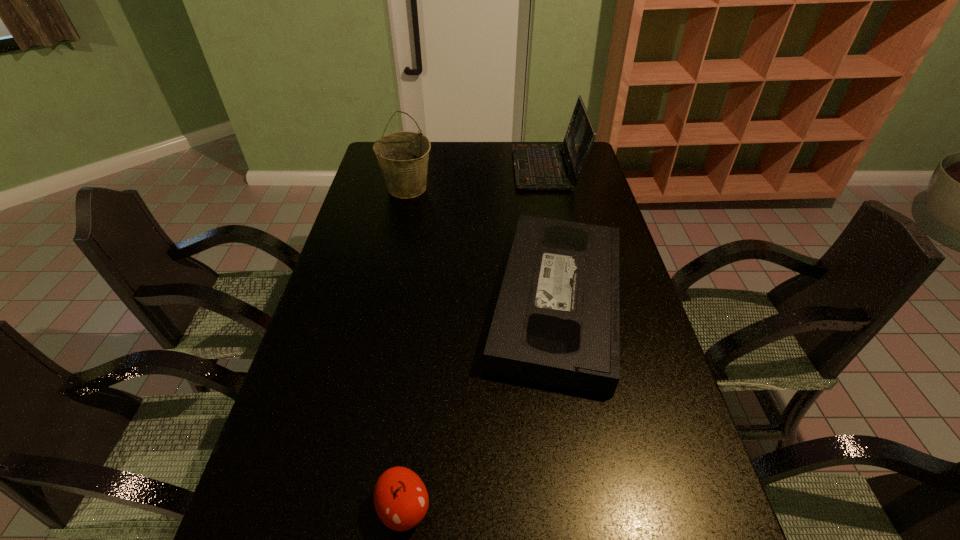
Identify the location of blank area located 0.230m on the right of the third tallest object. (550, 509).

The width and height of the screenshot is (960, 540). Find the location of `vacant space situated 0.060m on the front of the videotape`. vacant space situated 0.060m on the front of the videotape is located at coordinates [578, 421].

Find the location of a particular element. object present at the far edge is located at coordinates (537, 167).

Find the location of a particular element. object at the left edge is located at coordinates (403, 157).

Where is `laptop computer situated at the right edge`? The image size is (960, 540). laptop computer situated at the right edge is located at coordinates (537, 167).

I want to click on videotape at the right edge, so pos(556,322).

Identify the location of object present at the far right corner. This screenshot has height=540, width=960. (537, 167).

The height and width of the screenshot is (540, 960). Identify the location of vacant space at the far edge of the desktop. (484, 168).

The width and height of the screenshot is (960, 540). In the image, there is a desktop. What are the coordinates of `vacant space at the left edge` in the screenshot? It's located at (358, 251).

Locate an element on the screen. The height and width of the screenshot is (540, 960). free space at the right edge of the desktop is located at coordinates pos(584,180).